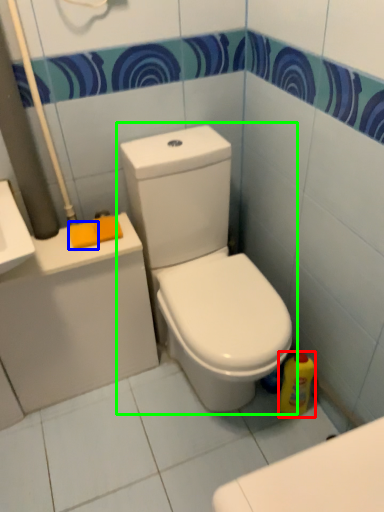
Question: Estimate the real-world distances between objects in this image. Which object is farther from cleaning product (highlighted by a red box), soap (highlighted by a blue box) or toilet (highlighted by a green box)?

Choices:
 (A) soap
 (B) toilet

Answer: (A)